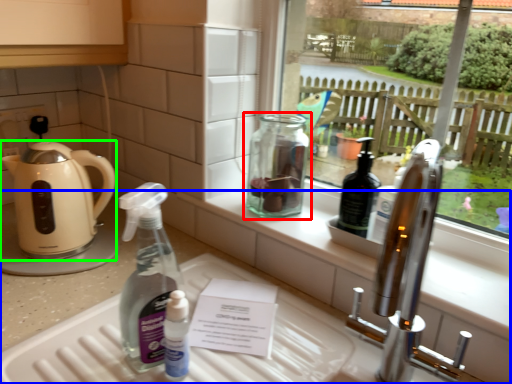
Question: Considering the real-world distances, which object is closest to bottle (highlighted by a red box)? counter (highlighted by a blue box) or kettle (highlighted by a green box).

Choices:
 (A) counter
 (B) kettle

Answer: (A)